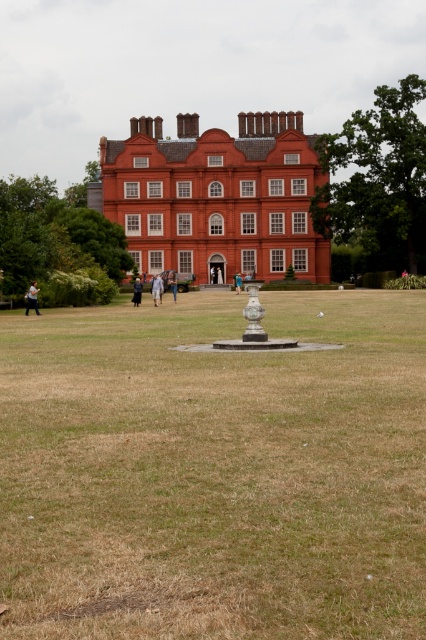
You are standing in front of the large red brick building and see the brown grass at center and the light blue denim jacket at center. Which object is located to the right of the other?

The brown grass at center is positioned on the right side of light blue denim jacket at center, so the brown grass at center is to the right of the light blue denim jacket at center.

You are standing in front of the building and see the light brown fabric jacket at lower left and the light blue fabric at center. Which object is closer to you?

The light brown fabric jacket at lower left is closer to you because it is in front of the light blue fabric at center.